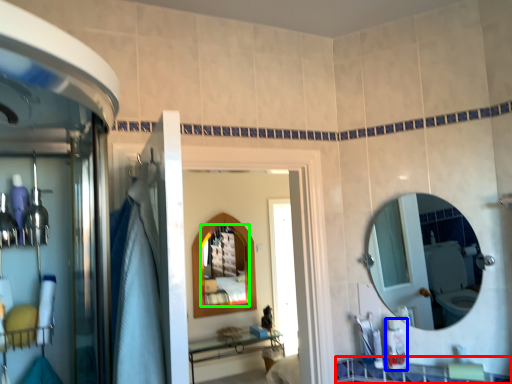
Question: Which object is the farthest from counter top (highlighted by a red box)? Choose among these: toiletry (highlighted by a blue box) or mirror (highlighted by a green box).

Choices:
 (A) toiletry
 (B) mirror

Answer: (B)